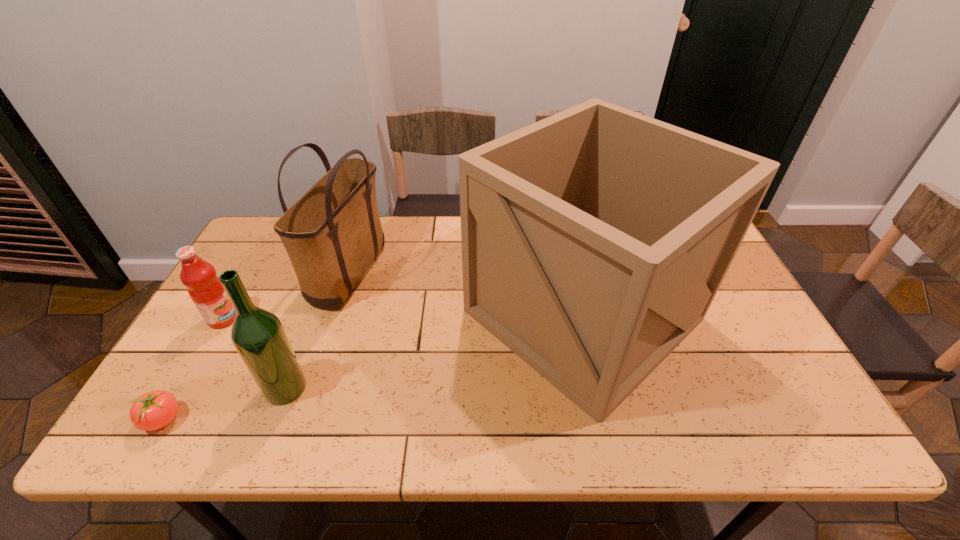
This screenshot has height=540, width=960. What are the coordinates of `object that can be found as the closest to the tote bag` in the screenshot? It's located at (204, 287).

This screenshot has width=960, height=540. What are the coordinates of `free spot that satisfies the following two spatial constraints: 1. on the front label of the alcohol; 2. on the left side of the fourth tallest object` in the screenshot? It's located at (184, 388).